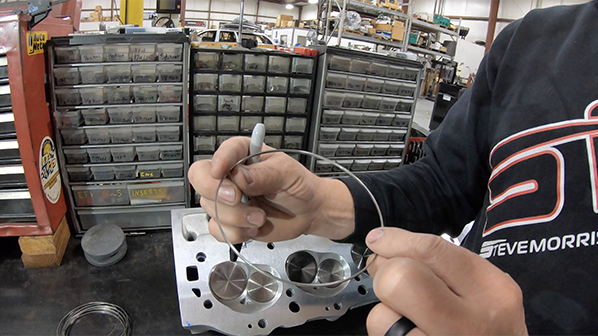
This screenshot has width=598, height=336. I want to click on part shelf, so click(x=373, y=109).